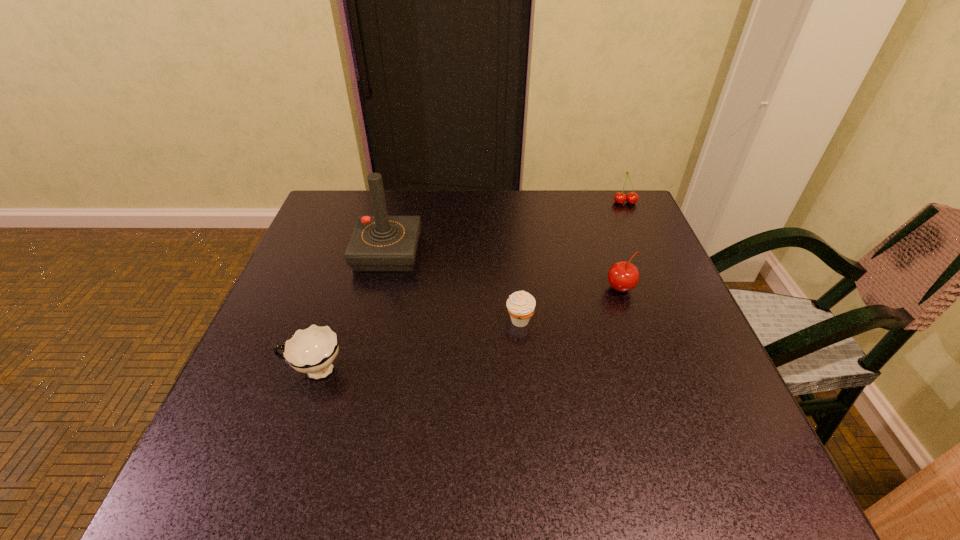
Locate an element on the screen. free space that satisfies the following two spatial constraints: 1. on the side of the second nearest object with the handle; 2. on the left side of the nearest object is located at coordinates (331, 320).

Locate an element on the screen. The width and height of the screenshot is (960, 540). vacant region that satisfies the following two spatial constraints: 1. on the side of the nearer cherry with the handle; 2. on the left side of the nearest object is located at coordinates (342, 288).

You are a GUI agent. You are given a task and a screenshot of the screen. Output one action in this format:
    pyautogui.click(x=<x>, y=<y>)
    Task: Click on the free space that satisfies the following two spatial constraints: 1. on the rectangular base of the joystick; 2. on the right side of the fourth farthest object
    Image resolution: width=960 pixels, height=540 pixels.
    Given the screenshot: What is the action you would take?
    pyautogui.click(x=371, y=320)

Identify the location of free space that satisfies the following two spatial constraints: 1. on the back side of the third object from left to right; 2. on the left side of the fourth object from left to right. click(x=516, y=288).